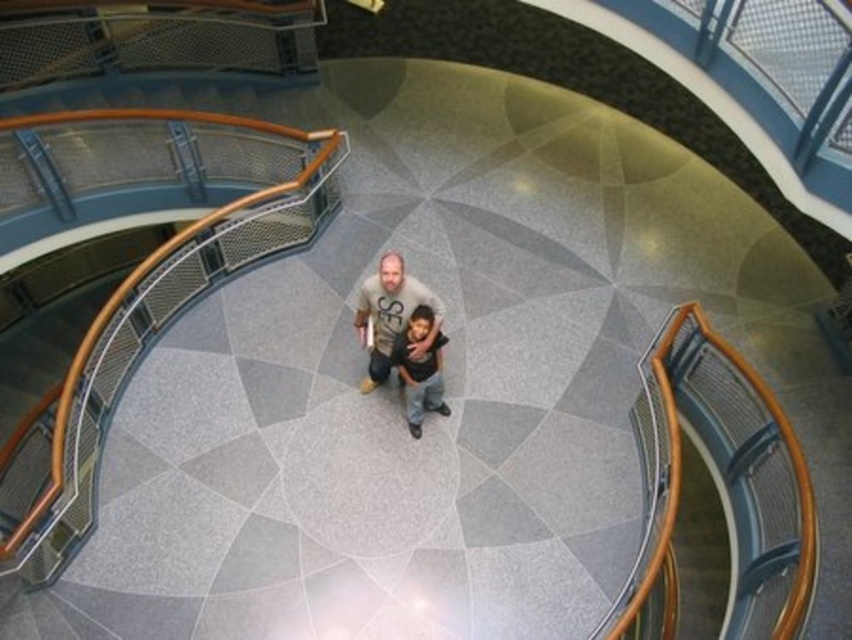
Question: Among these objects, which one is nearest to the camera?

Choices:
 (A) light beige t-shirt at center
 (B) dark gray jeans at center

Answer: (A)

Question: Is light beige t-shirt at center positioned at the back of dark gray jeans at center?

Choices:
 (A) yes
 (B) no

Answer: (B)

Question: Is light beige t-shirt at center bigger than dark gray jeans at center?

Choices:
 (A) yes
 (B) no

Answer: (A)

Question: Which point is farther from the camera taking this photo?

Choices:
 (A) (430, 362)
 (B) (389, 310)

Answer: (A)

Question: Which object appears closest to the camera in this image?

Choices:
 (A) light beige t-shirt at center
 (B) dark gray jeans at center

Answer: (A)

Question: Where is light beige t-shirt at center located in relation to dark gray jeans at center in the image?

Choices:
 (A) left
 (B) right

Answer: (A)